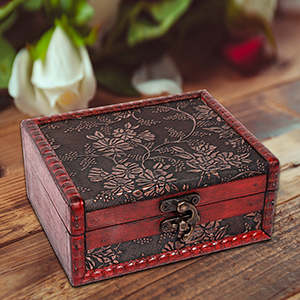
At what (x,y) coordinates should I click in order to perform the action: click on screws. Please return your answer as a coordinate pair (x, y). Image resolution: width=300 pixels, height=300 pixels. Looking at the image, I should click on (164, 208), (195, 199), (164, 226), (197, 221).